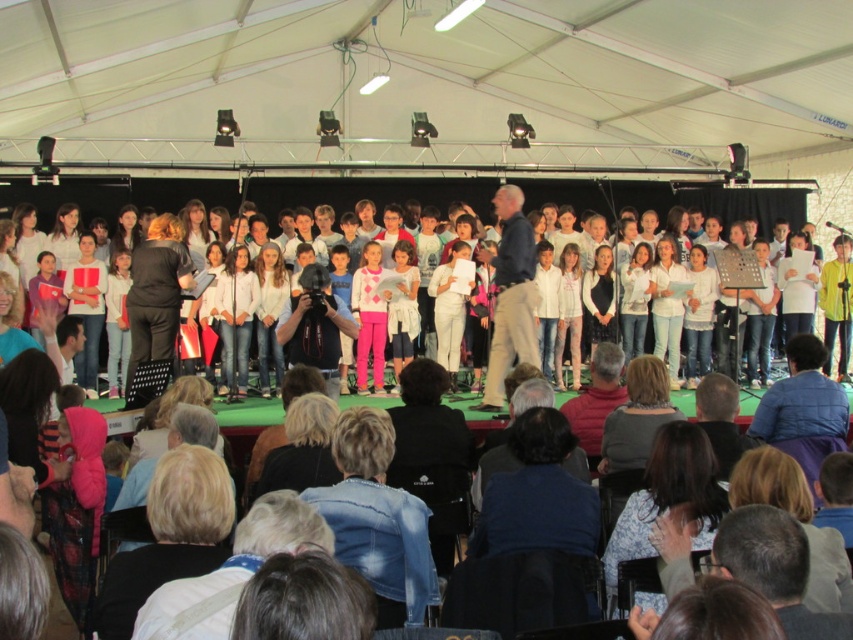
Where is `denim jacket at lower center`? denim jacket at lower center is located at coordinates (376, 518).

Does denim jacket at lower center appear on the right side of white cotton crowd at center?

Indeed, denim jacket at lower center is positioned on the right side of white cotton crowd at center.

Between point (401, 604) and point (744, 419), which one is positioned in front?

Positioned in front is point (401, 604).

Where is `denim jacket at lower center`? Image resolution: width=853 pixels, height=640 pixels. denim jacket at lower center is located at coordinates (376, 518).